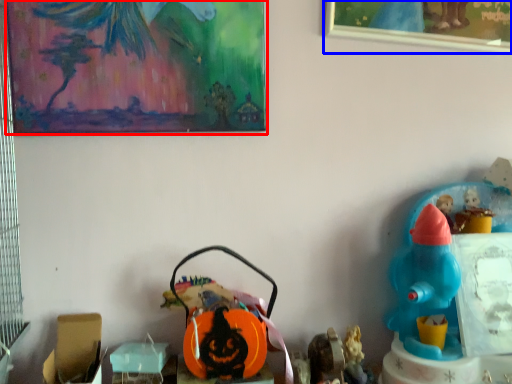
Question: Which point is further to the camera, picture frame (highlighted by a red box) or picture frame (highlighted by a blue box)?

Choices:
 (A) picture frame
 (B) picture frame

Answer: (B)